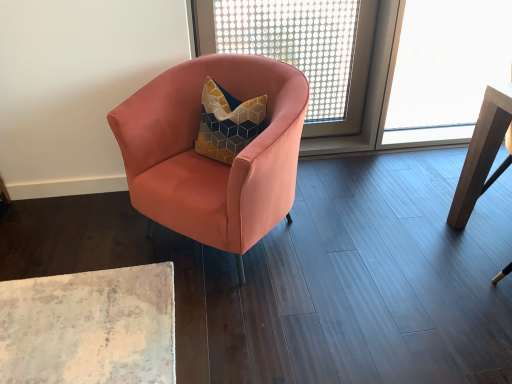
The width and height of the screenshot is (512, 384). I want to click on free spot below wooden table at right (from a real-world perspective), so click(x=497, y=210).